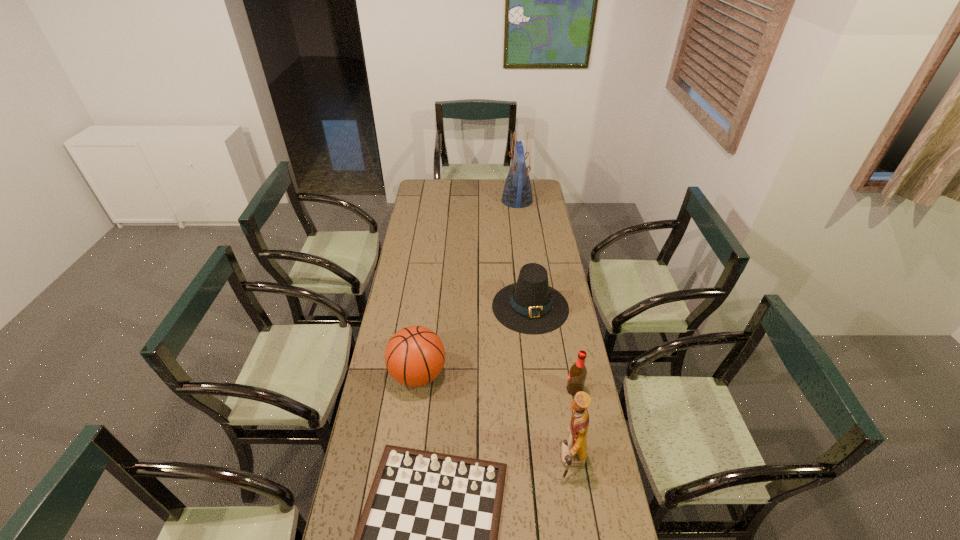
Where is `vacant space at the far edge`? This screenshot has height=540, width=960. vacant space at the far edge is located at coordinates (492, 184).

Locate an element on the screen. vacant space at the left edge is located at coordinates (405, 233).

Image resolution: width=960 pixels, height=540 pixels. In order to click on vacant point at the right edge in this screenshot , I will do `click(595, 513)`.

I want to click on free space between the beer bottle and the basketball, so click(496, 382).

In order to click on free space between the beer bottle and the fifth nearest object in this screenshot , I will do `click(552, 348)`.

Where is `vacant point located between the shopping bag and the second farthest object`? This screenshot has height=540, width=960. vacant point located between the shopping bag and the second farthest object is located at coordinates (524, 254).

At what (x,y) coordinates should I click in order to perform the action: click on vacant area that lies between the basketball and the fifth shortest object. Please return your answer as a coordinate pair (x, y). Looking at the image, I should click on (494, 418).

Where is `free space between the nutcracker and the fifth nearest object`? free space between the nutcracker and the fifth nearest object is located at coordinates (551, 384).

Point out which object is positioned as the third nearest to the basketball. Please provide its 2D coordinates. Your answer should be formatted as a tuple, i.e. [(x, y)], where the tuple contains the x and y coordinates of a point satisfying the conditions above.

[(573, 450)]

What are the coordinates of `the third closest object to the beer bottle` in the screenshot? It's located at (427, 539).